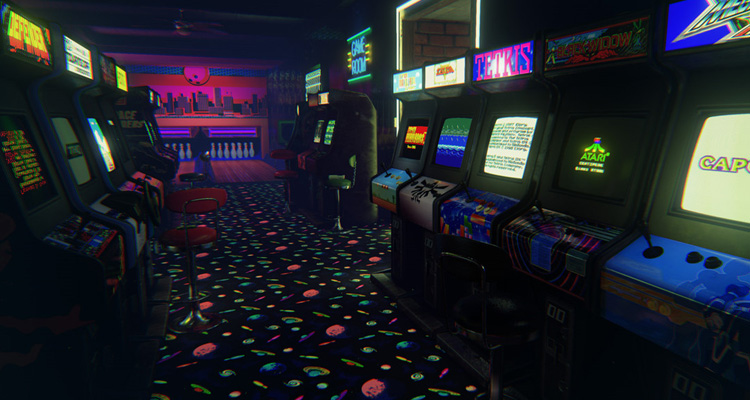
The height and width of the screenshot is (400, 750). What are the coordinates of `joystiq on arcade cabinet` in the screenshot? It's located at (648, 235), (466, 192), (409, 174), (382, 165), (528, 210), (136, 180), (76, 234), (110, 205).